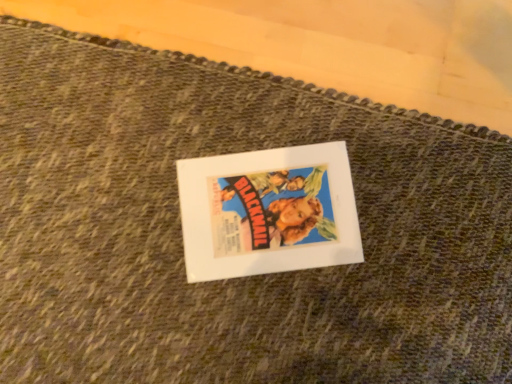
This screenshot has width=512, height=384. What do you see at coordinates (268, 212) in the screenshot?
I see `white paper at center` at bounding box center [268, 212].

Find the location of a particular element. This screenshot has width=512, height=384. white paper at center is located at coordinates (268, 212).

Measure the distance between white paper at center and camera.

white paper at center is 28.07 inches away from camera.

Locate an element on the screen. white paper at center is located at coordinates (268, 212).